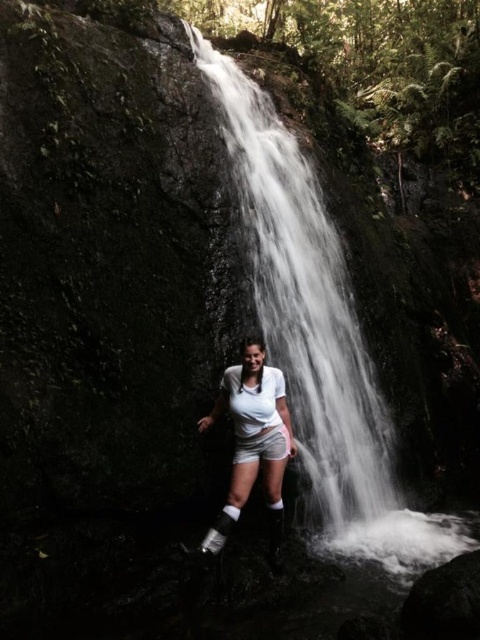
Question: Is white smooth waterfall at center thinner than white matte shorts at center?

Choices:
 (A) yes
 (B) no

Answer: (A)

Question: Does white matte shorts at center have a smaller size compared to white cotton shorts at center?

Choices:
 (A) yes
 (B) no

Answer: (B)

Question: Can you confirm if white smooth waterfall at center is bigger than white matte shorts at center?

Choices:
 (A) no
 (B) yes

Answer: (A)

Question: Which object is the farthest from the white cotton shorts at center?

Choices:
 (A) white matte shorts at center
 (B) white smooth waterfall at center

Answer: (B)

Question: Which point appears farthest from the camera in this image?

Choices:
 (A) (277, 448)
 (B) (243, 432)

Answer: (A)

Question: Which of these objects is positioned farthest from the white cotton shorts at center?

Choices:
 (A) white matte shorts at center
 (B) white smooth waterfall at center

Answer: (B)